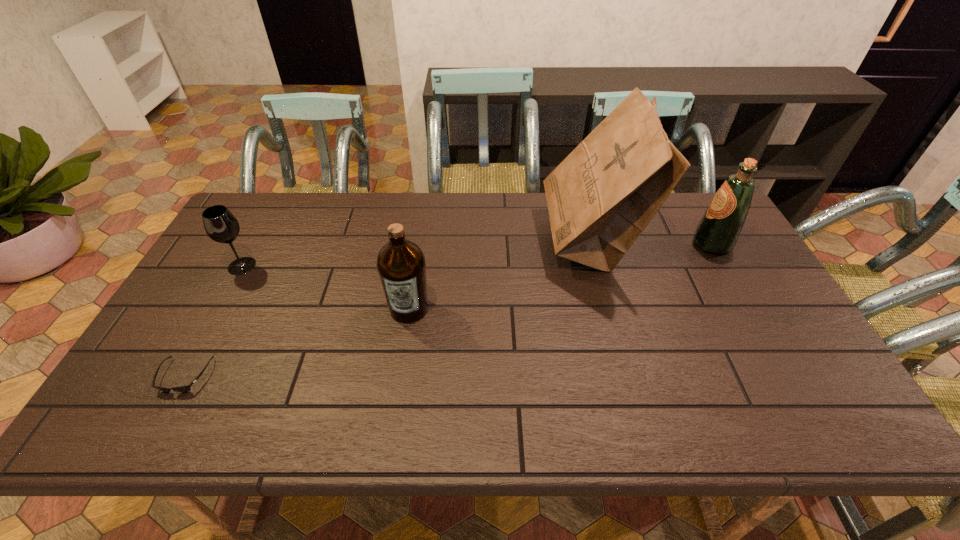
The image size is (960, 540). In order to click on the fourth object from left to right in this screenshot , I will do `click(601, 197)`.

Locate an element on the screen. grocery bag is located at coordinates (601, 197).

This screenshot has height=540, width=960. Find the location of `the right olive oil`. the right olive oil is located at coordinates (x=718, y=230).

Locate an element on the screen. The height and width of the screenshot is (540, 960). the rightmost object is located at coordinates (718, 230).

Where is `the fourth farthest object`? The height and width of the screenshot is (540, 960). the fourth farthest object is located at coordinates (401, 264).

Image resolution: width=960 pixels, height=540 pixels. I want to click on the third object from left to right, so click(x=401, y=264).

The height and width of the screenshot is (540, 960). In order to click on wineglass in this screenshot , I will do `click(220, 224)`.

At what (x,y) coordinates should I click in order to perform the action: click on the nearest object. Please return your answer as a coordinate pair (x, y). Looking at the image, I should click on coord(182,388).

This screenshot has height=540, width=960. I want to click on the shortest object, so click(x=182, y=388).

Where is `vacant space situated on the left of the tallest object`? This screenshot has height=540, width=960. vacant space situated on the left of the tallest object is located at coordinates (448, 240).